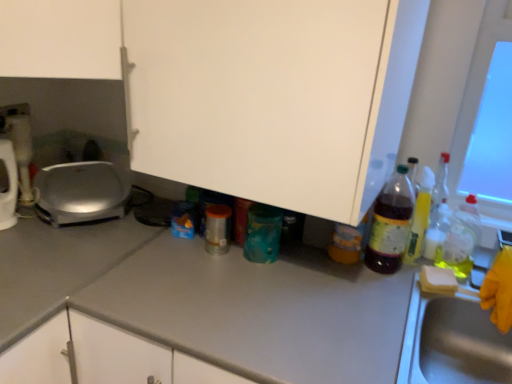
Describe the element at coordinates (452, 341) in the screenshot. This screenshot has width=512, height=384. I see `metallic stainless steel sink at right` at that location.

Measure the distance between point (8,173) and camera.

Point (8,173) and camera are 4.55 feet apart.

Identify the location of metallic silver can at center, which appears as the 1th bottle when viewed from the left. (217, 228).

Find the location of a particular element. metallic stainless steel sink at right is located at coordinates (452, 341).

Is there a large distance between gray matte countertop at center and teal matte canister at center, positioned as the 2th bottle in left-to-right order?

No, there isn't a large distance between gray matte countertop at center and teal matte canister at center, positioned as the 2th bottle in left-to-right order.

What's the angular difference between gray matte countertop at center and teal matte canister at center, positioned as the 2th bottle in left-to-right order,'s facing directions?

89 degrees separate the facing orientations of gray matte countertop at center and teal matte canister at center, positioned as the 2th bottle in left-to-right order.

Is gray matte countertop at center bigger or smaller than teal matte canister at center, positioned as the 2th bottle in left-to-right order?

Clearly, gray matte countertop at center is larger in size than teal matte canister at center, positioned as the 2th bottle in left-to-right order.

In the scene shown: Can you confirm if metallic stainless steel sink at right is smaller than teal matte canister at center, the 4th bottle in the right-to-left sequence?

No, metallic stainless steel sink at right is not smaller than teal matte canister at center, the 4th bottle in the right-to-left sequence.

From the image's perspective, which bottle is the 2nd one above the metallic stainless steel sink at right? Please provide its 2D coordinates.

[(262, 233)]

Is metallic stainless steel sink at right oriented towards teal matte canister at center, positioned as the 2th bottle in left-to-right order?

No, metallic stainless steel sink at right is not aimed at teal matte canister at center, positioned as the 2th bottle in left-to-right order.

In the image, is metallic stainless steel sink at right positioned in front of or behind teal matte canister at center, positioned as the 2th bottle in left-to-right order?

metallic stainless steel sink at right is positioned closer to the viewer than teal matte canister at center, positioned as the 2th bottle in left-to-right order.

Consider the image. Does teal matte canister at center, the 4th bottle in the right-to-left sequence, have a smaller size compared to yellow sponge at right?

No.

Can you confirm if teal matte canister at center, the 4th bottle in the right-to-left sequence, is shorter than yellow sponge at right?

No.

There is a yellow sponge at right. At what (x,y) coordinates should I click in order to perform the action: click on the 2nd bottle above it (from the image's perspective). Please return your answer as a coordinate pair (x, y). Looking at the image, I should click on (262, 233).

From a real-world perspective, who is located higher, translucent plastic bottle at right, which is the 3th bottle from left to right, or silver metallic waffle maker at left, the first appliance viewed from the right?

In real-world perspective, translucent plastic bottle at right, which is the 3th bottle from left to right, is above.

Is point (385, 226) closer or farther from the camera than point (98, 193)?

Point (385, 226).

Can you confirm if translucent plastic bottle at right, which is the 3th bottle from left to right, is smaller than silver metallic waffle maker at left, the first appliance viewed from the right?

Yes.

Is translucent plastic bottle at right, which is the 3th bottle from right to left, oriented towards silver metallic waffle maker at left, the first appliance viewed from the right?

No, translucent plastic bottle at right, which is the 3th bottle from right to left, is not oriented towards silver metallic waffle maker at left, the first appliance viewed from the right.

Can you see teal matte canister at center, positioned as the 2th bottle in left-to-right order, touching translucent plastic bottle at right, which is the 3th bottle from left to right?

There is a gap between teal matte canister at center, positioned as the 2th bottle in left-to-right order, and translucent plastic bottle at right, which is the 3th bottle from left to right.

Considering the positions of objects teal matte canister at center, positioned as the 2th bottle in left-to-right order, and translucent plastic bottle at right, which is the 3th bottle from left to right, in the image provided, who is more to the left, teal matte canister at center, positioned as the 2th bottle in left-to-right order, or translucent plastic bottle at right, which is the 3th bottle from left to right,?

Positioned to the left is teal matte canister at center, positioned as the 2th bottle in left-to-right order.

Looking at their sizes, would you say teal matte canister at center, the 4th bottle in the right-to-left sequence, is wider or thinner than translucent plastic bottle at right, which is the 3th bottle from right to left?

Considering their sizes, teal matte canister at center, the 4th bottle in the right-to-left sequence, looks broader than translucent plastic bottle at right, which is the 3th bottle from right to left.

From a real-world perspective, which object rests below the other?

teal matte canister at center, positioned as the 2th bottle in left-to-right order, is physically lower.

How different are the orientations of metallic silver can at center, the fifth bottle viewed from the right, and white glossy kettle at left, the first appliance positioned from the left, in degrees?

They differ by 86.8 degrees in their facing directions.

Could you tell me if metallic silver can at center, the fifth bottle viewed from the right, is facing white glossy kettle at left, the first appliance positioned from the left?

No, metallic silver can at center, the fifth bottle viewed from the right, is not aimed at white glossy kettle at left, the first appliance positioned from the left.

Considering the sizes of metallic silver can at center, the fifth bottle viewed from the right, and white glossy kettle at left, which is the 3th appliance in right-to-left order, in the image, is metallic silver can at center, the fifth bottle viewed from the right, bigger or smaller than white glossy kettle at left, which is the 3th appliance in right-to-left order,?

metallic silver can at center, the fifth bottle viewed from the right, is smaller than white glossy kettle at left, which is the 3th appliance in right-to-left order.

From the image's perspective, which is below, metallic silver can at center, the fifth bottle viewed from the right, or white glossy kettle at left, the first appliance positioned from the left?

metallic silver can at center, the fifth bottle viewed from the right, is shown below in the image.

Does translucent plastic bottle at right, the 5th bottle in the left-to-right sequence, appear on the left side of yellow sponge at right?

In fact, translucent plastic bottle at right, the 5th bottle in the left-to-right sequence, is to the right of yellow sponge at right.

Is translucent plastic bottle at right, the 5th bottle in the left-to-right sequence, not within yellow sponge at right?

Yes, translucent plastic bottle at right, the 5th bottle in the left-to-right sequence, is not within yellow sponge at right.

Is translucent plastic bottle at right, the 1th bottle when ordered from right to left, facing away from yellow sponge at right?

translucent plastic bottle at right, the 1th bottle when ordered from right to left, is not turned away from yellow sponge at right.

From the image's perspective, starting from the gray matte countertop at center, which bottle is the 2nd one above? Please provide its 2D coordinates.

[(262, 233)]

Locate an element on the screen. The image size is (512, 384). the 3rd bottle to the left of the metallic stainless steel sink at right, starting your count from the anchor is located at coordinates (262, 233).

Looking at this image, estimate the real-world distances between objects in this image. Which object is further from metallic silver toaster at left, the second appliance viewed from the left, translucent plastic bottle at right, the 2th bottle in the right-to-left sequence, or translucent plastic bottle at right, the 5th bottle in the left-to-right sequence?

translucent plastic bottle at right, the 5th bottle in the left-to-right sequence, is further to metallic silver toaster at left, the second appliance viewed from the left.

From the image, which object appears to be farther from metallic stainless steel sink at right, translucent plastic bottle at right, the 2th bottle in the right-to-left sequence, or metallic silver toaster at left, the second appliance viewed from the left?

metallic silver toaster at left, the second appliance viewed from the left.

When comparing their distances from translucent plastic bottle at right, the 5th bottle in the left-to-right sequence, does silver metallic waffle maker at left, which is the 3th appliance from left to right, or metallic silver can at center, which appears as the 1th bottle when viewed from the left, seem further?

silver metallic waffle maker at left, which is the 3th appliance from left to right, lies further to translucent plastic bottle at right, the 5th bottle in the left-to-right sequence, than the other object.

From the image, which object appears to be farther from teal matte canister at center, positioned as the 2th bottle in left-to-right order, silver metallic waffle maker at left, which is the 3th appliance from left to right, or metallic silver toaster at left, the second appliance viewed from the left?

metallic silver toaster at left, the second appliance viewed from the left, lies further to teal matte canister at center, positioned as the 2th bottle in left-to-right order, than the other object.

When comparing their distances from gray matte countertop at center, does metallic silver can at center, the fifth bottle viewed from the right, or translucent plastic bottle at right, the 1th bottle when ordered from right to left, seem closer?

metallic silver can at center, the fifth bottle viewed from the right, is closer to gray matte countertop at center.

Looking at the image, which one is located closer to translucent plastic bottle at right, which is the 3th bottle from left to right, yellow sponge at right or metallic stainless steel sink at right?

The object closer to translucent plastic bottle at right, which is the 3th bottle from left to right, is yellow sponge at right.

From the image, which object appears to be farther from metallic silver toaster at left, marked as the 2th appliance in a right-to-left arrangement, white glossy kettle at left, which is the 3th appliance in right-to-left order, or teal matte canister at center, the 4th bottle in the right-to-left sequence?

teal matte canister at center, the 4th bottle in the right-to-left sequence.

Based on their spatial positions, is yellow sponge at right or teal matte canister at center, the 4th bottle in the right-to-left sequence, further from metallic silver can at center, the fifth bottle viewed from the right?

yellow sponge at right is positioned further to the anchor metallic silver can at center, the fifth bottle viewed from the right.

The width and height of the screenshot is (512, 384). I want to click on sink between gray matte countertop at center and translucent plastic bottle at right, the 2th bottle in the right-to-left sequence, from front to back, so pos(452,341).

Identify the location of food situated between white glossy kettle at left, which is the 3th appliance in right-to-left order, and translucent plastic bottle at right, the 5th bottle in the left-to-right sequence, from left to right. This screenshot has width=512, height=384. (438, 280).

Where is `sink that lies between translucent plastic bottle at right, which is the 3th bottle from left to right, and gray matte countertop at center from top to bottom`? sink that lies between translucent plastic bottle at right, which is the 3th bottle from left to right, and gray matte countertop at center from top to bottom is located at coordinates (452, 341).

Where is `counter top between white glossy kettle at left, the first appliance positioned from the left, and translucent plastic bottle at right, the 1th bottle when ordered from right to left, from left to right`? The image size is (512, 384). counter top between white glossy kettle at left, the first appliance positioned from the left, and translucent plastic bottle at right, the 1th bottle when ordered from right to left, from left to right is located at coordinates (57, 266).